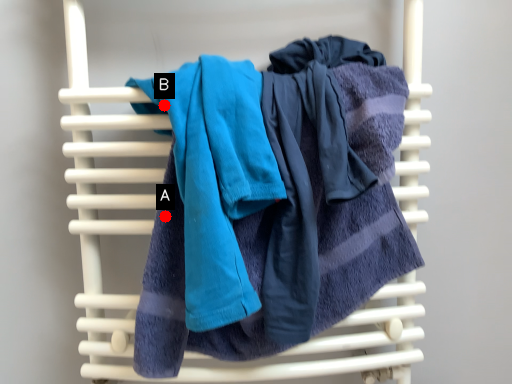
Question: Two points are circled on the image, labeled by A and B beside each circle. Which point is farther from the camera taking this photo?

Choices:
 (A) A is further
 (B) B is further

Answer: (A)